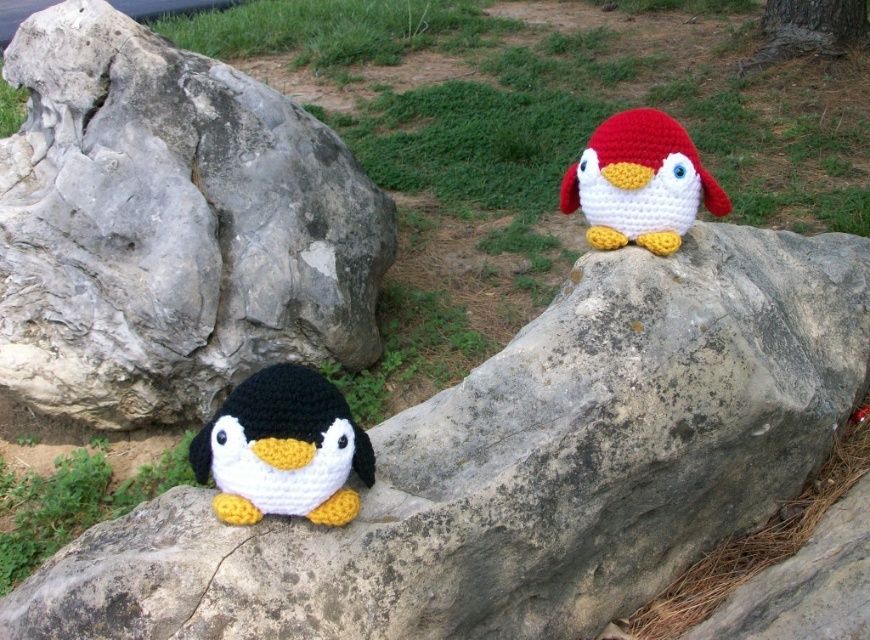
Question: Is gray rough rock at center to the left of red yarn penguin at upper right from the viewer's perspective?

Choices:
 (A) yes
 (B) no

Answer: (A)

Question: Is black yarn penguin at lower left thinner than red yarn penguin at upper right?

Choices:
 (A) no
 (B) yes

Answer: (B)

Question: Which of the following is the closest to the observer?

Choices:
 (A) (637, 220)
 (B) (99, 525)

Answer: (B)

Question: Which of these objects is positioned closest to the red yarn penguin at upper right?

Choices:
 (A) gray rough rock at center
 (B) black yarn penguin at lower left

Answer: (A)

Question: Estimate the real-world distances between objects in this image. Which object is closer to the gray rough rock at center?

Choices:
 (A) black yarn penguin at lower left
 (B) red yarn penguin at upper right
 (C) gray rough boulder at lower left

Answer: (A)

Question: In this image, where is black yarn penguin at lower left located relative to red yarn penguin at upper right?

Choices:
 (A) below
 (B) above

Answer: (A)